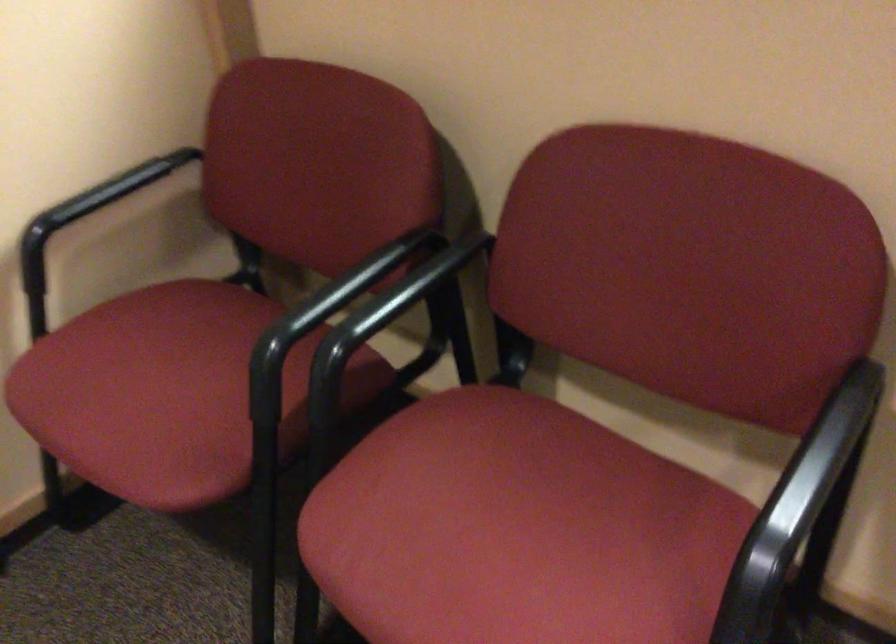
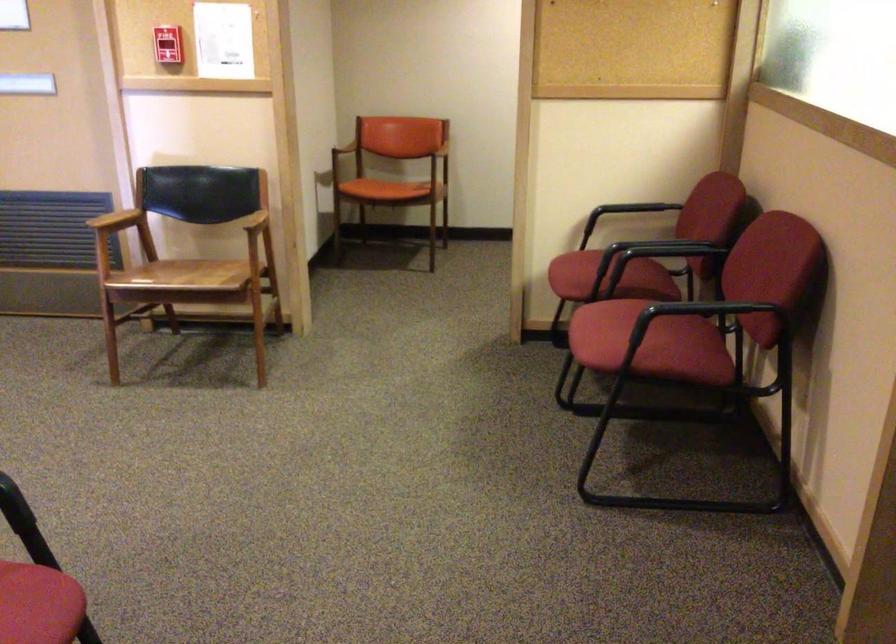
Find the pixel in the second image that matches point (615, 545) in the first image.

(650, 343)